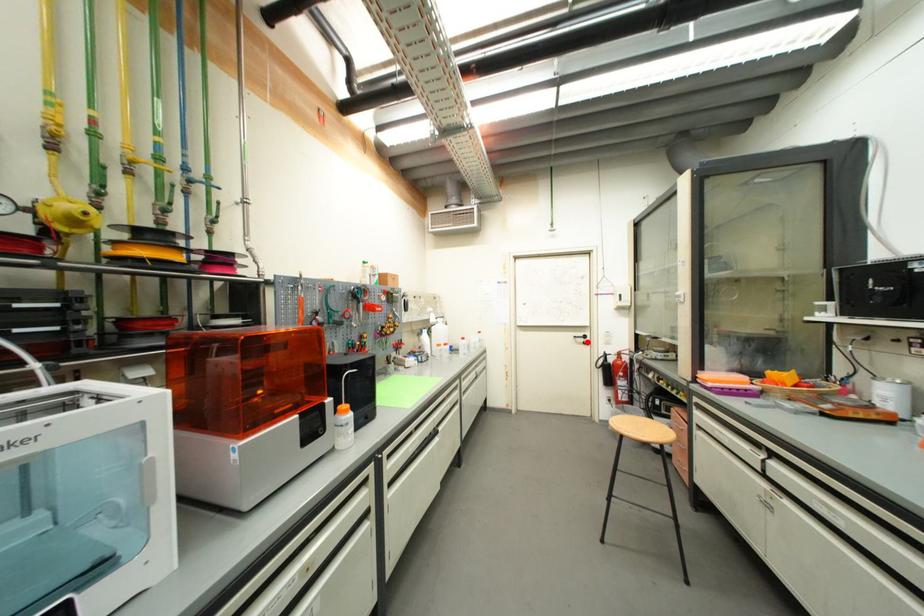
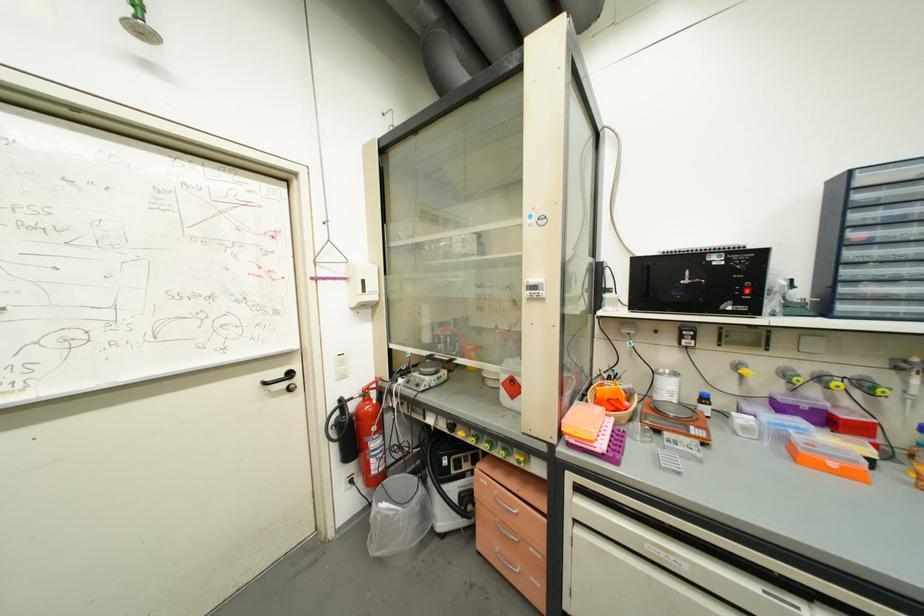
Question: I am providing you with two images of the same scene from different viewpoints. A red point is shown in image1. For the corresponding object point in image2, is it positioned nearer or farther from the camera?

Choices:
 (A) Nearer
 (B) Farther

Answer: (A)